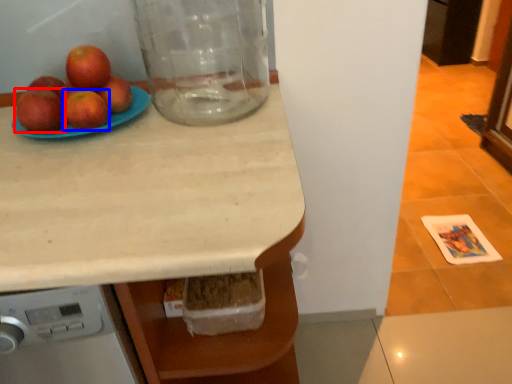
Question: Which object is closer to the camera taking this photo, apple (highlighted by a red box) or apple (highlighted by a blue box)?

Choices:
 (A) apple
 (B) apple

Answer: (A)